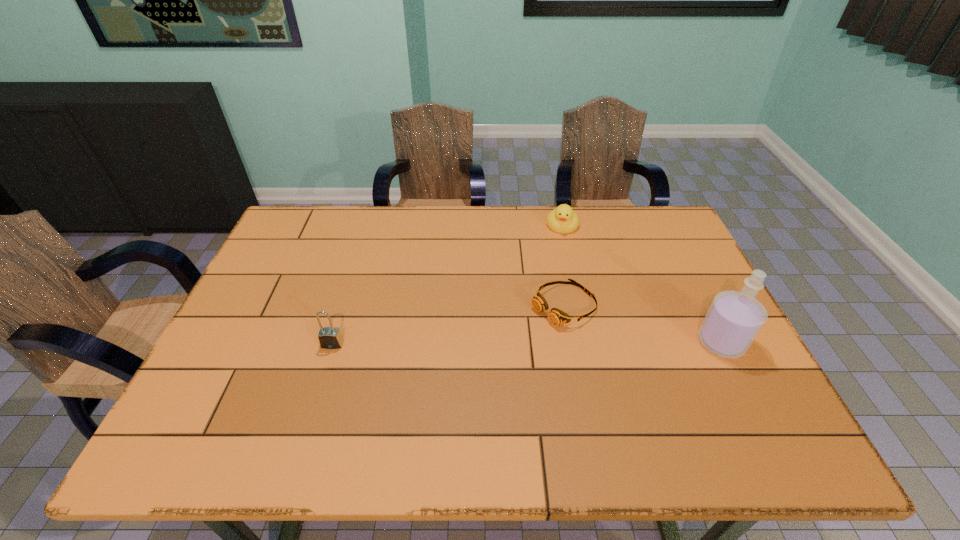
Image resolution: width=960 pixels, height=540 pixels. Find the location of `vacant area situated on the face of the farthest object`. vacant area situated on the face of the farthest object is located at coordinates (548, 313).

Locate an element on the screen. vacant position located on the face of the farthest object is located at coordinates (552, 290).

This screenshot has height=540, width=960. What are the coordinates of `free region located with the lenses facing forward on the goggles` in the screenshot? It's located at (415, 402).

Image resolution: width=960 pixels, height=540 pixels. I want to click on vacant space located with the lenses facing forward on the goggles, so click(505, 343).

Where is `vacant space located with the lenses facing forward on the goggles`? The image size is (960, 540). vacant space located with the lenses facing forward on the goggles is located at coordinates (422, 397).

You are a GUI agent. You are given a task and a screenshot of the screen. Output one action in this format:
    pyautogui.click(x=<x>, y=<y>)
    Task: Click on the object that is at the far edge
    The width and height of the screenshot is (960, 540).
    Given the screenshot: What is the action you would take?
    pyautogui.click(x=563, y=219)

Where is `object present at the right edge`? The image size is (960, 540). object present at the right edge is located at coordinates (734, 319).

Find the location of a particular element. blank space at the far edge is located at coordinates (397, 218).

I want to click on free region at the left edge of the desktop, so click(x=273, y=349).

Find the location of a particular element. vacant space at the right edge of the desktop is located at coordinates (660, 290).